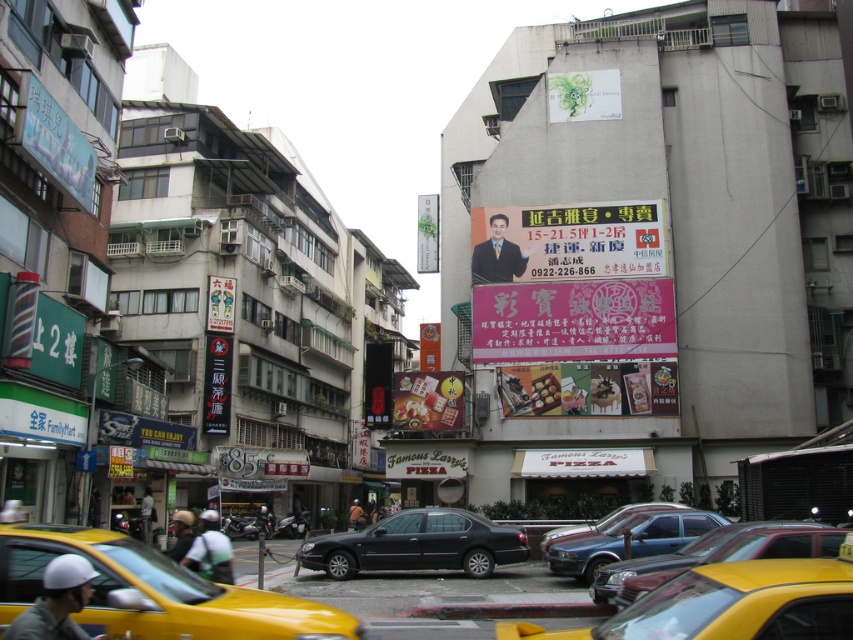
Question: Does matte black signboard at center lie in front of matte plastic signboard at center?

Choices:
 (A) yes
 (B) no

Answer: (B)

Question: Can you confirm if yellow matte taxi at lower left is wider than white cardboard sign at center?

Choices:
 (A) no
 (B) yes

Answer: (A)

Question: Which object is the farthest from the yellow matte taxi at lower left?

Choices:
 (A) green matte poster at upper center
 (B) matte chocolate bar at center

Answer: (A)

Question: Observing the image, what is the correct spatial positioning of matte chocolate bar at center in reference to green matte sign at upper left?

Choices:
 (A) above
 (B) below

Answer: (B)

Question: Estimate the real-world distances between objects in this image. Which object is farther from the metallic silver car at center?

Choices:
 (A) matte plastic signboard at center
 (B) metallic gold sign at center
 (C) black metallic car at center

Answer: (B)

Question: Which point is closer to the camera taking this photo?

Choices:
 (A) (73, 317)
 (B) (566, 632)

Answer: (B)